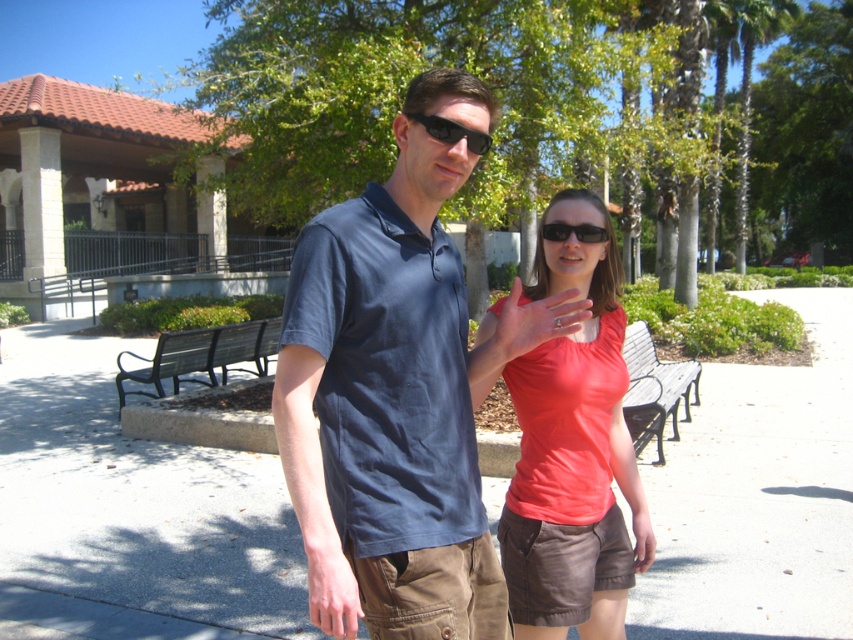
Question: Is gray concrete pavement at center positioned at the back of matte blue shirt at center?

Choices:
 (A) yes
 (B) no

Answer: (A)

Question: Which point is closer to the camera taking this photo?

Choices:
 (A) (602, 608)
 (B) (369, 209)
 (C) (418, 118)

Answer: (C)

Question: Where is matte blue shirt at center located in relation to matte orange shirt at center in the image?

Choices:
 (A) above
 (B) below

Answer: (A)

Question: Which point appears farthest from the camera in this image?

Choices:
 (A) (358, 388)
 (B) (607, 234)
 (C) (334, 573)

Answer: (B)

Question: Does matte blue shirt at center appear over black matte sunglasses at center?

Choices:
 (A) yes
 (B) no

Answer: (B)

Question: Which object is closer to the camera taking this photo?

Choices:
 (A) light skin tone hand at center
 (B) matte orange shirt at center

Answer: (A)